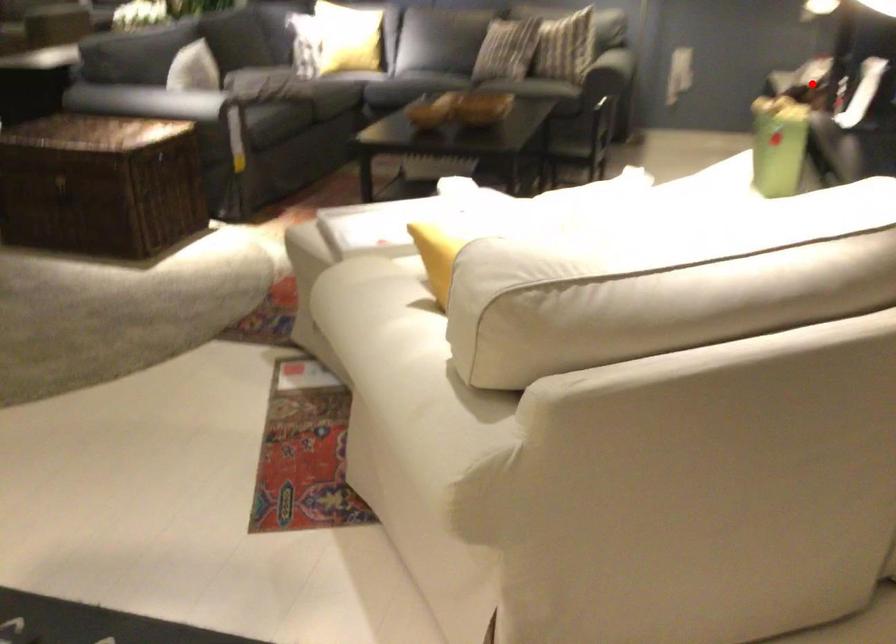
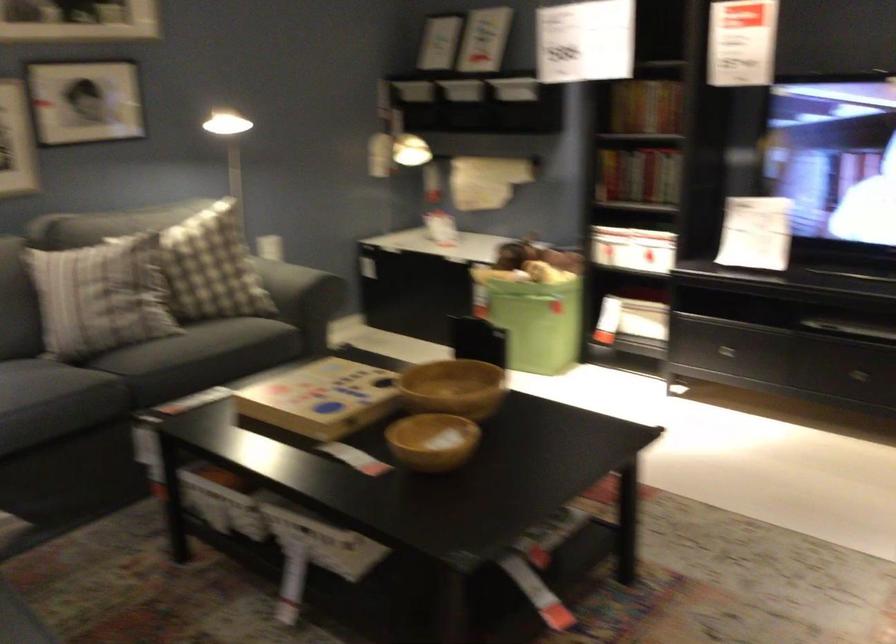
Question: I am providing you with two images of the same scene from different viewpoints. In image1, a red point is highlighted. Considering the same 3D point in image2, which of the following is correct?

Choices:
 (A) It is closer
 (B) It is farther

Answer: (A)